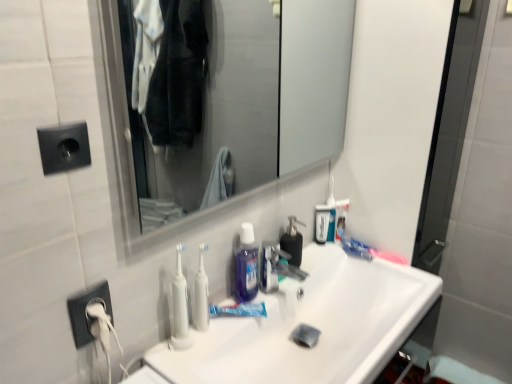
Question: Is the depth of clear glass mirror at upper center less than that of black matte soap dispenser at center?

Choices:
 (A) yes
 (B) no

Answer: (A)

Question: From a real-world perspective, is clear glass mirror at upper center over black matte soap dispenser at center?

Choices:
 (A) yes
 (B) no

Answer: (A)

Question: From the image's perspective, is clear glass mirror at upper center below black matte soap dispenser at center?

Choices:
 (A) no
 (B) yes

Answer: (A)

Question: Is clear glass mirror at upper center outside black matte soap dispenser at center?

Choices:
 (A) yes
 (B) no

Answer: (A)

Question: Is black matte soap dispenser at center a part of clear glass mirror at upper center?

Choices:
 (A) no
 (B) yes

Answer: (A)

Question: Relative to blue glossy toothpaste at center, is black plastic electric outlet at lower left, placed as the 2th electric outlet when sorted from top to bottom, in front or behind?

Choices:
 (A) behind
 (B) front

Answer: (B)

Question: Is black plastic electric outlet at lower left, arranged as the 1th electric outlet when ordered from the bottom, spatially inside blue glossy toothpaste at center, or outside of it?

Choices:
 (A) inside
 (B) outside

Answer: (B)

Question: From a real-world perspective, is black plastic electric outlet at lower left, marked as the 1th electric outlet in a back-to-front arrangement, above or below blue glossy toothpaste at center?

Choices:
 (A) below
 (B) above

Answer: (B)

Question: In terms of height, does black plastic electric outlet at lower left, placed as the 2th electric outlet when sorted from top to bottom, look taller or shorter compared to blue glossy toothpaste at center?

Choices:
 (A) tall
 (B) short

Answer: (A)

Question: Do you think blue glossy toothpaste at center is within black plastic socket at upper left, marked as the 1th electric outlet in a top-to-bottom arrangement, or outside of it?

Choices:
 (A) inside
 (B) outside

Answer: (B)

Question: Is point (249, 307) positioned closer to the camera than point (72, 127)?

Choices:
 (A) closer
 (B) farther

Answer: (B)

Question: From their relative heights in the image, would you say blue glossy toothpaste at center is taller or shorter than black plastic socket at upper left, marked as the 2th electric outlet in a back-to-front arrangement?

Choices:
 (A) short
 (B) tall

Answer: (A)

Question: Based on their sizes in the image, would you say blue glossy toothpaste at center is bigger or smaller than black plastic socket at upper left, which appears as the 2th electric outlet when ordered from the bottom?

Choices:
 (A) big
 (B) small

Answer: (A)

Question: In the image, is black plastic socket at upper left, acting as the first electric outlet starting from the front, on the left side or the right side of pink plastic toothbrush at upper right, arranged as the first toothbrush when viewed from the back?

Choices:
 (A) right
 (B) left

Answer: (B)

Question: In terms of width, does black plastic socket at upper left, acting as the first electric outlet starting from the front, look wider or thinner when compared to pink plastic toothbrush at upper right, placed as the 1th toothbrush when sorted from right to left?

Choices:
 (A) wide
 (B) thin

Answer: (B)